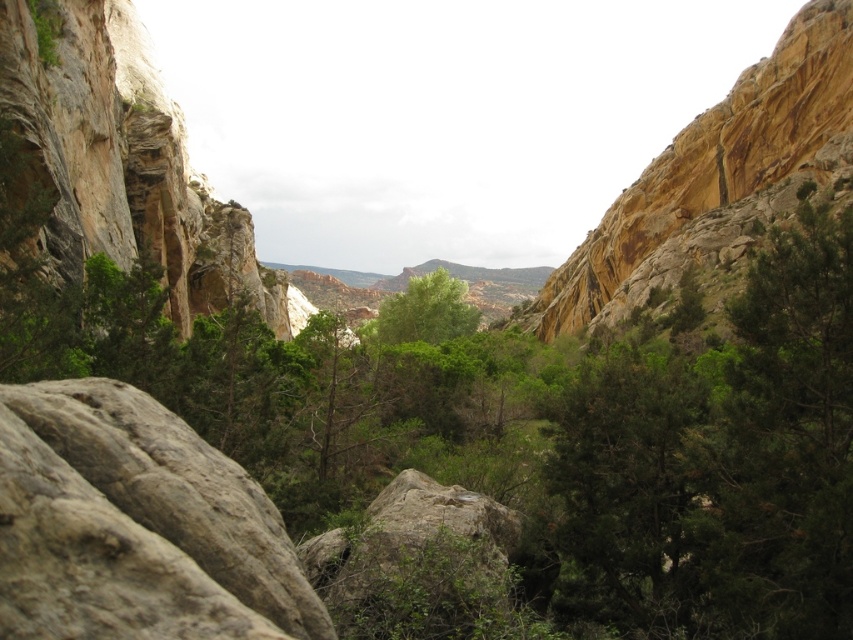
You are a hiker trying to decide which landmark to photograph first. You see the yellowish rock cliff at right and the green leafy tree at center. Which one appears larger in the scene?

The yellowish rock cliff at right is bigger than the green leafy tree at center, so it appears larger in the scene.

You are a hiker trying to navigate through this rocky terrain. You need to step on the gray rough rock at lower left and the green leafy tree at center. Which one should you choose to step on if you want to avoid slipping?

The gray rough rock at lower left has a smaller size compared to the green leafy tree at center. Since smaller rocks can be less stable, you should step on the green leafy tree at center instead.